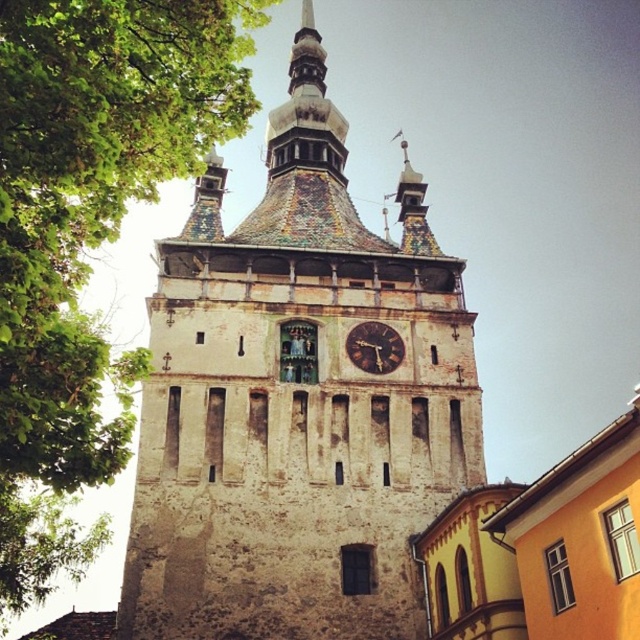
You are standing in front of the weathered stone clock tower at center and want to take a photo of the green leafy tree at upper left in the background. Will the tree be partially hidden by the tower in your photo?

The weathered stone clock tower at center is further to the viewer than the green leafy tree at upper left, so the tree will not be hidden by the tower in the photo.

In the scene shown: You are standing in front of the historic stone tower and notice a green leafy tree at upper left and a brown wooden clock at center. Which object is positioned more to the left side of the tower?

The green leafy tree at upper left is positioned more to the left side of the tower than the brown wooden clock at center.